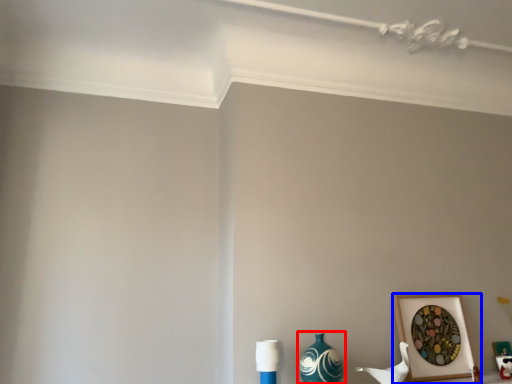
Question: Which point is closer to the camera, vase (highlighted by a red box) or picture frame (highlighted by a blue box)?

Choices:
 (A) vase
 (B) picture frame

Answer: (A)